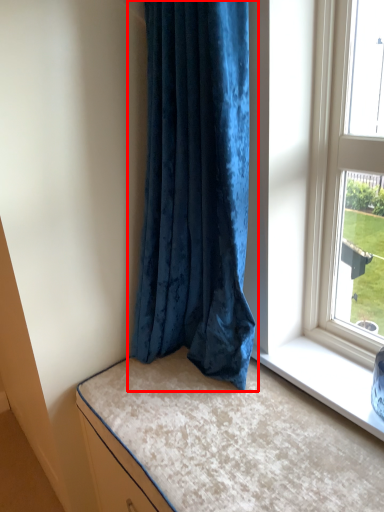
Question: From the image's perspective, where is curtain (annotated by the red box) located relative to bed?

Choices:
 (A) below
 (B) above

Answer: (B)